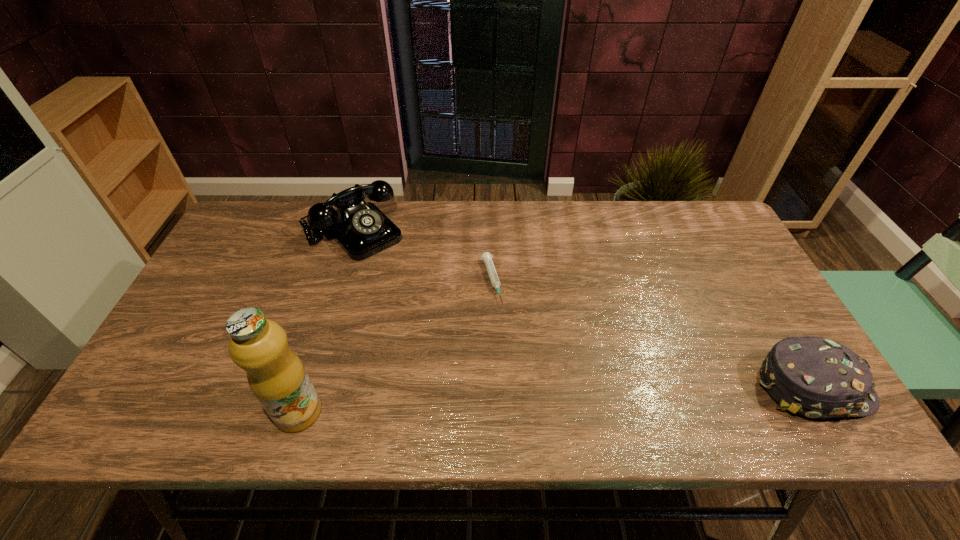
You are a GUI agent. You are given a task and a screenshot of the screen. Output one action in this format:
    pyautogui.click(x=<x>, y=<y>)
    Task: Click on the vacant region at the right edge of the desktop
    The height and width of the screenshot is (540, 960).
    Given the screenshot: What is the action you would take?
    pyautogui.click(x=756, y=298)

The height and width of the screenshot is (540, 960). I want to click on free space at the far right corner, so click(x=686, y=242).

Find the location of a particular element. vacant area that lies between the rightmost object and the telephone is located at coordinates (583, 309).

Identify the location of unoccupied position between the tallest object and the third object from left to right. This screenshot has height=540, width=960. (395, 346).

Identify the location of vacant area that lies between the third shortest object and the shortest object. tap(422, 256).

You are a GUI agent. You are given a task and a screenshot of the screen. Output one action in this format:
    pyautogui.click(x=<x>, y=<y>)
    Task: Click on the empty space that is in between the syringe and the third tallest object
    The width and height of the screenshot is (960, 540).
    Given the screenshot: What is the action you would take?
    pyautogui.click(x=652, y=334)

What are the coordinates of `unoccupied position between the tallest object and the headwear` in the screenshot? It's located at pos(556,399).

In order to click on vacant area that lies between the fruit juice and the syringe in this screenshot , I will do `click(395, 346)`.

You are a GUI agent. You are given a task and a screenshot of the screen. Output one action in this format:
    pyautogui.click(x=<x>, y=<y>)
    Task: Click on the vacant space that's between the shortest object and the third tallest object
    This screenshot has width=960, height=540.
    Given the screenshot: What is the action you would take?
    pyautogui.click(x=652, y=334)

Locate an element on the screen. This screenshot has width=960, height=540. vacant area between the third tallest object and the tallest object is located at coordinates (556, 399).